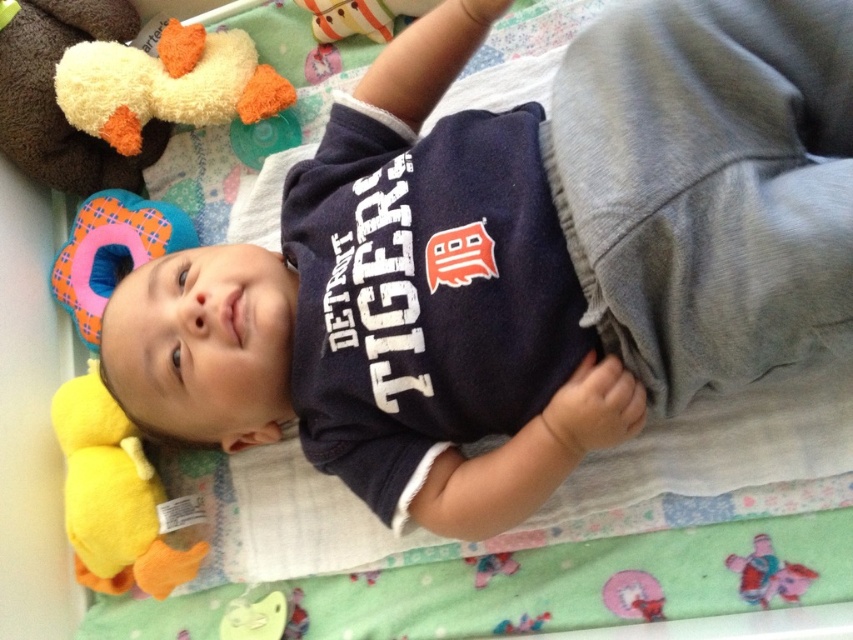
Which is above, yellow plush duck at lower left or soft plush toy at upper left?

Positioned higher is soft plush toy at upper left.

Can you confirm if yellow plush duck at lower left is positioned below soft plush toy at upper left?

Yes.

Is point (85, 403) positioned behind point (83, 340)?

That is False.

At what (x,y) coordinates should I click in order to perform the action: click on yellow plush duck at lower left. Please return your answer as a coordinate pair (x, y). The image size is (853, 640). Looking at the image, I should click on (112, 497).

Where is `soft plush toy at upper left`? Image resolution: width=853 pixels, height=640 pixels. soft plush toy at upper left is located at coordinates (112, 252).

Which of these two, soft plush toy at upper left or striped plush toy at upper center, stands shorter?

striped plush toy at upper center

Who is more forward, (149, 243) or (332, 28)?

Positioned in front is point (149, 243).

The height and width of the screenshot is (640, 853). Identify the location of soft plush toy at upper left. (112, 252).

Between point (334, 35) and point (798, 595), which one is positioned behind?

Point (334, 35)

Is striped plush toy at upper center further to camera compared to red plush elephant at lower right?

That is True.

Is point (370, 12) more distant than point (785, 577)?

Yes, point (370, 12) is behind point (785, 577).

This screenshot has width=853, height=640. Find the location of `striped plush toy at upper center`. striped plush toy at upper center is located at coordinates (360, 17).